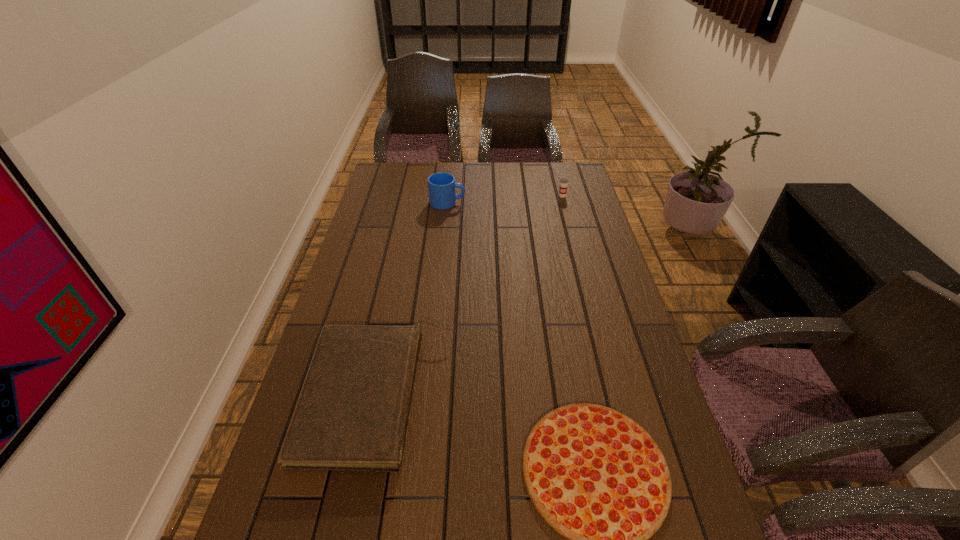
This screenshot has width=960, height=540. Find the location of `object that is the second closest one to the cup`. object that is the second closest one to the cup is located at coordinates click(352, 413).

Locate an element on the screen. The width and height of the screenshot is (960, 540). object that is the closest to the mug is located at coordinates (563, 182).

You are a GUI agent. You are given a task and a screenshot of the screen. Output one action in this format:
    pyautogui.click(x=<x>, y=<y>)
    Task: Click on the free point that satisfies the following two spatial constraints: 1. on the side of the cup with the logo; 2. on the spine side of the paperback book
    
    Given the screenshot: What is the action you would take?
    pyautogui.click(x=613, y=395)

Image resolution: width=960 pixels, height=540 pixels. Identify the location of free space that satisfies the following two spatial constraints: 1. on the side of the cup with the logo; 2. on the side of the mug with the handle. (564, 202).

Locate an element on the screen. This screenshot has width=960, height=540. free spot that satisfies the following two spatial constraints: 1. on the side of the cup with the logo; 2. on the spine side of the paperback book is located at coordinates (613, 395).